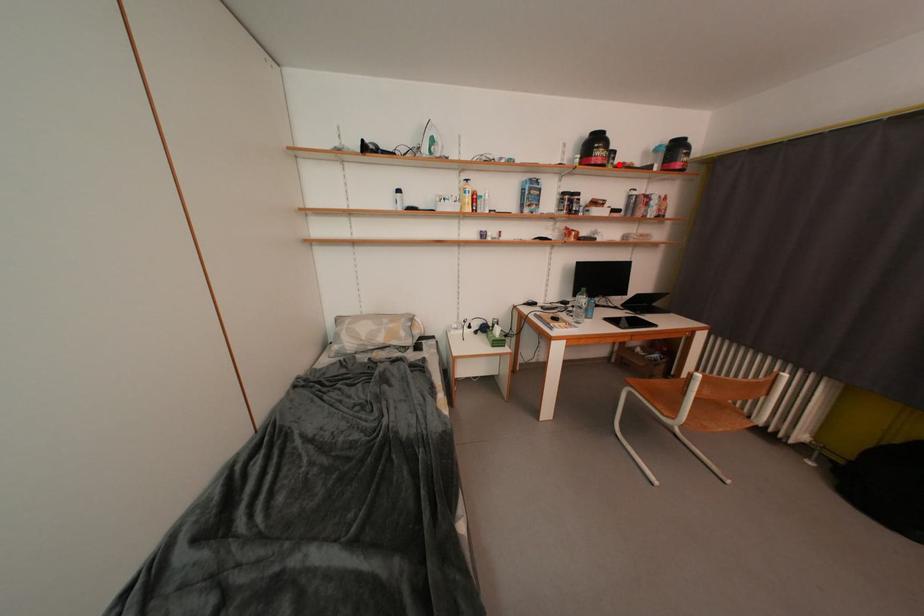
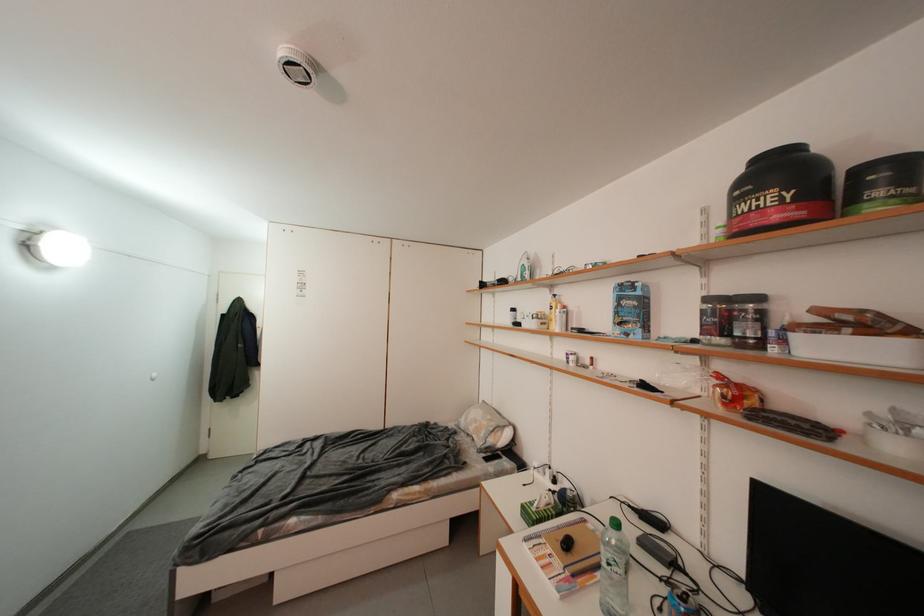
Question: A red point is marked in image1. In image2, is the corresponding 3D point closer to the camera or farther? Reply with the corresponding letter.

Choices:
 (A) The corresponding 3D point is closer.
 (B) The corresponding 3D point is farther.

Answer: (B)